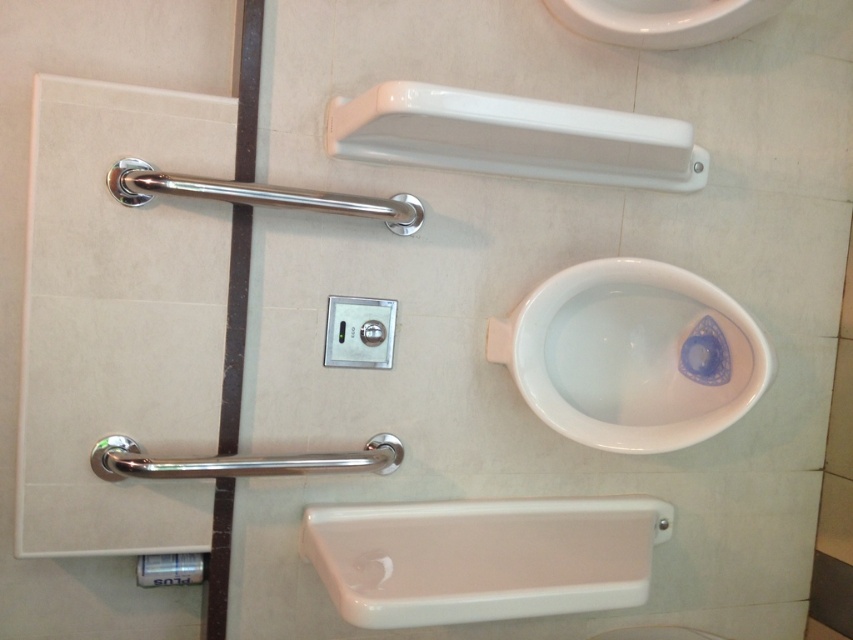
You are a home inspector assessing bathroom accessibility. You notice the white glossy toilet bowl at center and the white glossy towel bar at upper center. Which object is located to the right of the other?

The white glossy toilet bowl at center is positioned on the right side of the white glossy towel bar at upper center.

You are a guest in this bathroom and need to hang a small hand towel. The hand towel is 30 cm long. You see the white glossy towel bar at upper center and the brushed metal towel bar at lower center. Which towel bar can accommodate the hand towel without it dragging on the floor?

The brushed metal towel bar at lower center is lower than the white glossy towel bar at upper center. Since the hand towel is 30 cm long, hanging it on the lower bar would leave less space between the towel and the floor, making it more likely to drag. Therefore, the white glossy towel bar at upper center is the better choice as it provides more vertical space to prevent dragging.